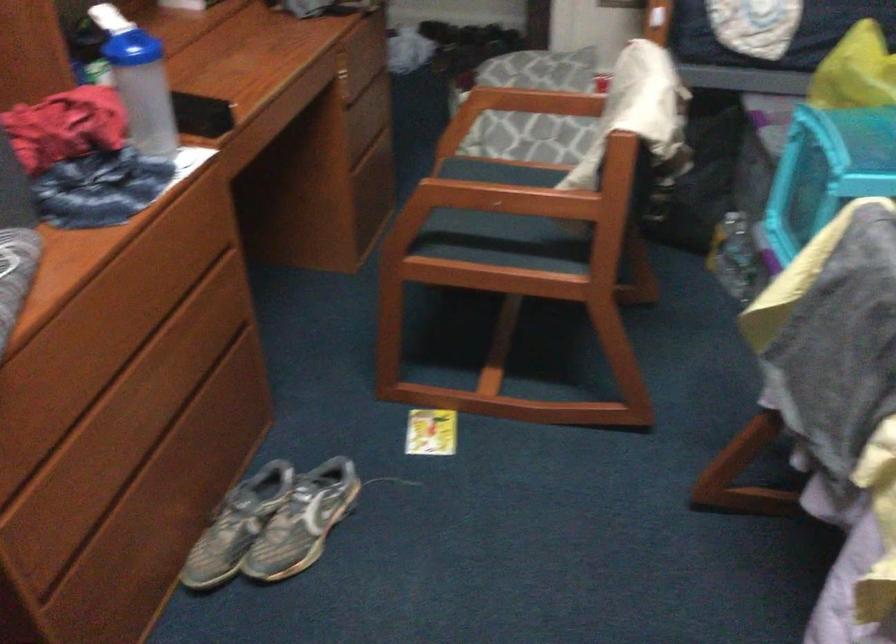
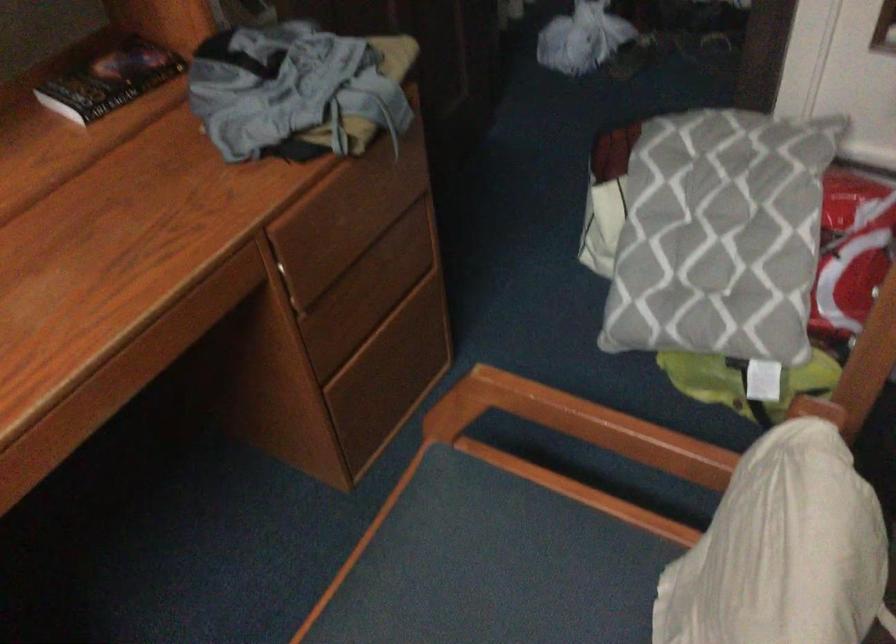
Locate, in the second image, the point that corresponds to the point at 528,96 in the first image.

(579, 424)